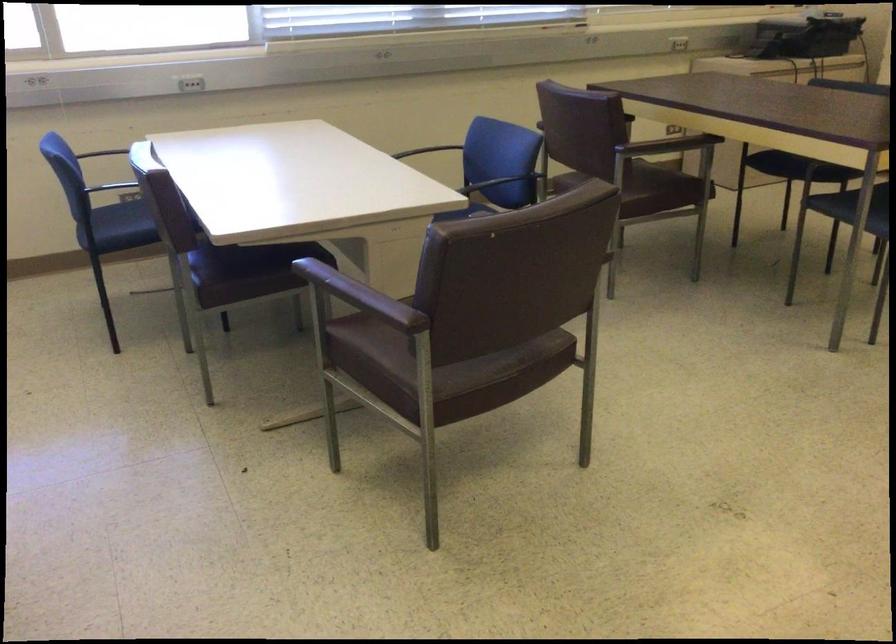
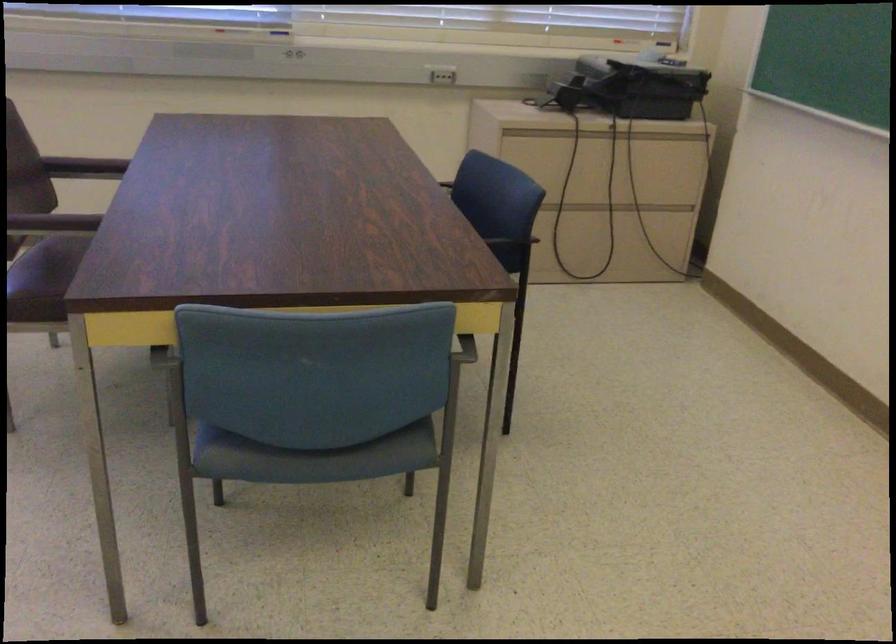
In a continuous first-person perspective shot, in which direction is the camera moving?

The cameraman walked toward right, forward.